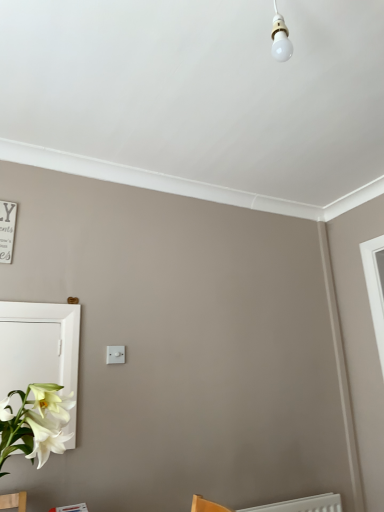
Question: From a real-world perspective, is white plastic light switch at center above or below white glossy medicine cabinet at lower left?

Choices:
 (A) above
 (B) below

Answer: (A)

Question: Considering the positions of white plastic light switch at center and white glossy medicine cabinet at lower left in the image, is white plastic light switch at center taller or shorter than white glossy medicine cabinet at lower left?

Choices:
 (A) tall
 (B) short

Answer: (B)

Question: In terms of width, does white plastic light switch at center look wider or thinner when compared to white glossy medicine cabinet at lower left?

Choices:
 (A) wide
 (B) thin

Answer: (B)

Question: Looking at the image, does white glossy medicine cabinet at lower left seem bigger or smaller compared to white plastic light switch at center?

Choices:
 (A) big
 (B) small

Answer: (A)

Question: In the image, is white glossy medicine cabinet at lower left on the left side or the right side of white plastic light switch at center?

Choices:
 (A) right
 (B) left

Answer: (B)

Question: Considering the positions of point (71, 334) and point (117, 349), is point (71, 334) closer or farther from the camera than point (117, 349)?

Choices:
 (A) closer
 (B) farther

Answer: (A)

Question: From the image's perspective, relative to white plastic light switch at center, is white glossy medicine cabinet at lower left above or below?

Choices:
 (A) above
 (B) below

Answer: (B)